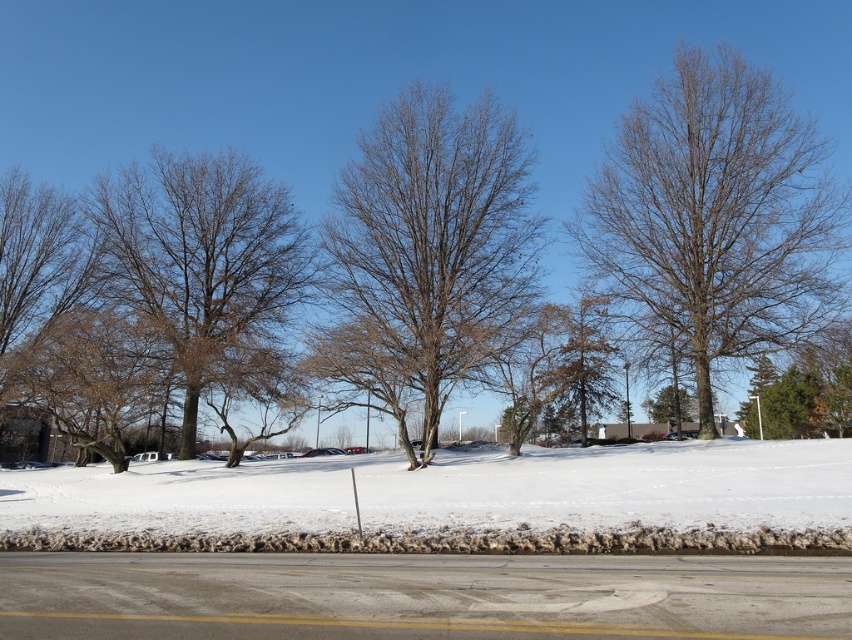
You are standing at the point with coordinates point (600, 305) and want to walk towards the point (177, 305). Given that both points are on the same vertical line, will you be moving closer to or further away from the camera as you walk?

Since point (177, 305) is further to the camera than point (600, 305), walking from point (600, 305) towards point (177, 305) will bring you closer to the camera.

You are standing on the paved road and see the bare brown tree at left and the green leafy tree at center. Which tree is closer to your right side?

The green leafy tree at center is closer to your right side because the bare brown tree at left is positioned on the left side of it.